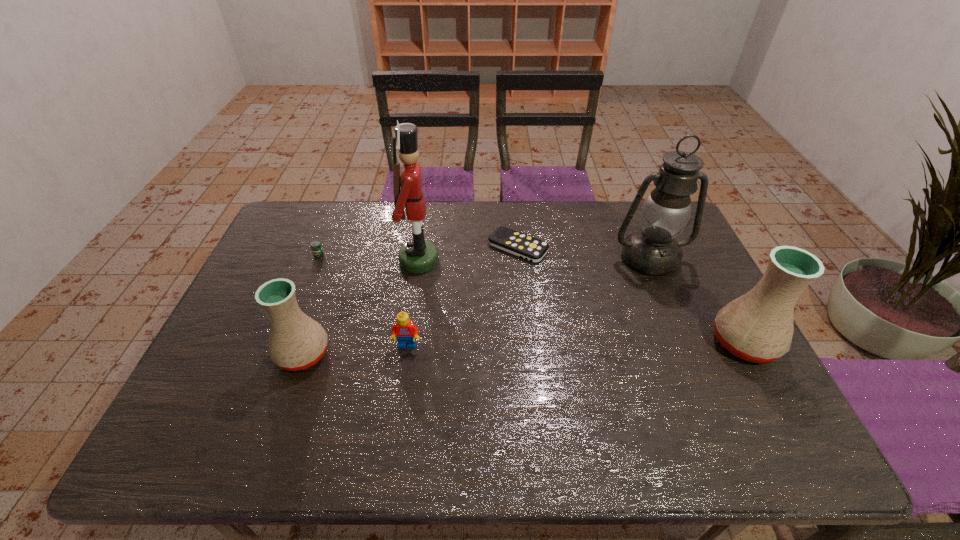
Image resolution: width=960 pixels, height=540 pixels. I want to click on vacant space that's between the third object from right to left and the nutcracker, so click(x=468, y=254).

I want to click on blank region between the Lego and the taller pottery, so click(576, 344).

Identify the location of free space between the nutcracker and the Lego. The image size is (960, 540). (413, 303).

The height and width of the screenshot is (540, 960). I want to click on free space between the Lego and the right pottery, so click(576, 344).

Identify the location of free spot between the remote control and the oil lamp. This screenshot has width=960, height=540. (584, 252).

The image size is (960, 540). I want to click on free space between the right pottery and the second shortest object, so click(x=532, y=299).

Where is `vacant area that lies between the nutcracker and the sixth tallest object`? This screenshot has width=960, height=540. vacant area that lies between the nutcracker and the sixth tallest object is located at coordinates (369, 258).

Choose which object is the sixth nearest neighbor to the oil lamp. Please provide its 2D coordinates. Your answer should be formatted as a tuple, i.e. [(x, y)], where the tuple contains the x and y coordinates of a point satisfying the conditions above.

[(316, 247)]

Locate an element on the screen. the closest object to the oil lamp is located at coordinates (758, 327).

What are the coordinates of `free region that satisfies the following two spatial constraints: 1. on the front side of the fourth shortest object; 2. on the right side of the sixth tallest object` in the screenshot? It's located at (279, 354).